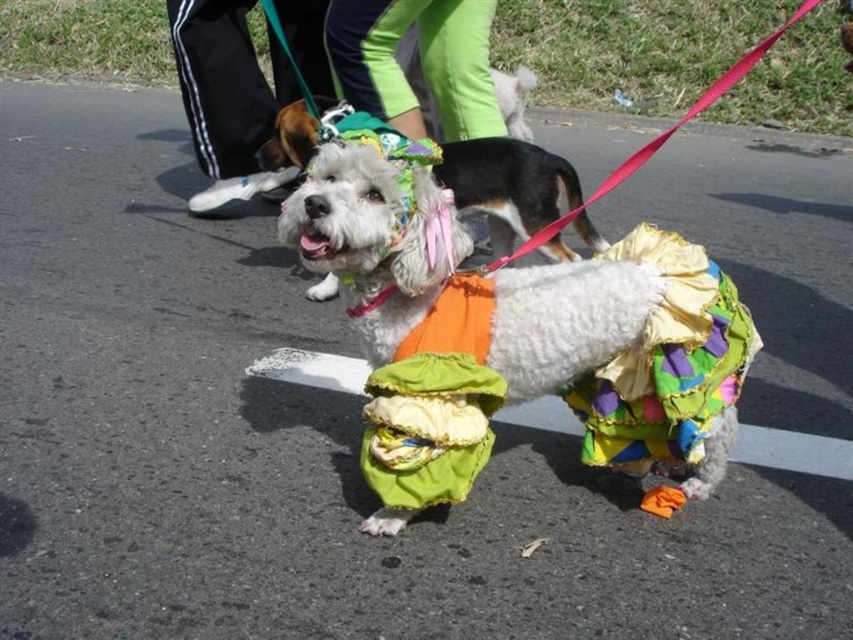
You are a photographer trying to capture both the white fluffy dog at center and the black fabric pants at upper left in a single shot. Given that your camera can only focus on objects wider than 20 cm, will both objects be in focus?

The white fluffy dog at center has a larger width than the black fabric pants at upper left. Since the camera focuses on objects wider than 20 cm, both objects will be in focus as the white fluffy dog at center is wider than 20 cm and the black fabric pants at upper left must also be wider than 20 cm to be included in the focus range.

You are a photographer trying to capture both the white fluffy dog at center and the black fabric pants at upper left in a single shot. Based on their sizes in the image, which one would appear smaller in the final photo?

The white fluffy dog at center appears smaller in the final photo because it has a lesser height compared to the black fabric pants at upper left.

Where is the white fluffy dog at center located in the image?

The white fluffy dog at center is located at point (514, 332).